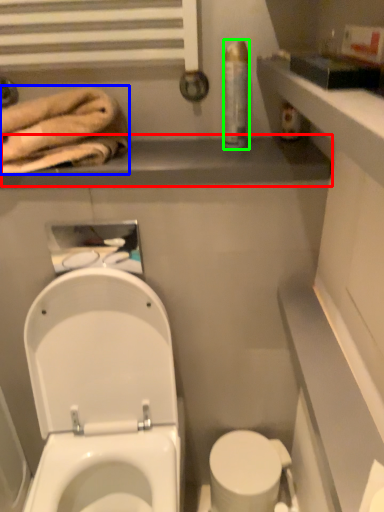
Question: Estimate the real-world distances between objects in this image. Which object is farther from balustrade (highlighted by a red box), bath towel (highlighted by a blue box) or toiletry (highlighted by a green box)?

Choices:
 (A) bath towel
 (B) toiletry

Answer: (B)